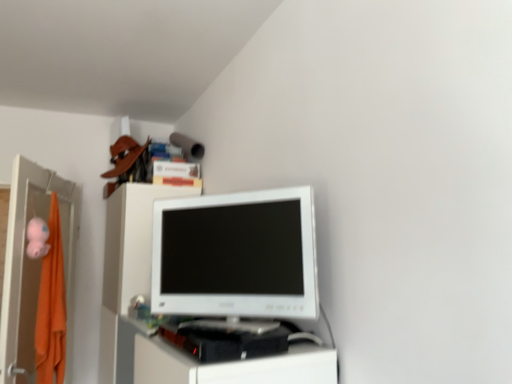
Question: Does white glossy computer monitor at center have a greater height compared to orange fabric file cabinet at left?

Choices:
 (A) no
 (B) yes

Answer: (A)

Question: Is orange fabric file cabinet at left at the back of white glossy computer monitor at center?

Choices:
 (A) no
 (B) yes

Answer: (A)

Question: Can we say white glossy computer monitor at center lies outside orange fabric file cabinet at left?

Choices:
 (A) yes
 (B) no

Answer: (A)

Question: Does white glossy computer monitor at center come behind orange fabric file cabinet at left?

Choices:
 (A) no
 (B) yes

Answer: (A)

Question: Is white glossy computer monitor at center to the right of orange fabric file cabinet at left from the viewer's perspective?

Choices:
 (A) yes
 (B) no

Answer: (A)

Question: Is white glossy computer monitor at center smaller than orange fabric file cabinet at left?

Choices:
 (A) no
 (B) yes

Answer: (B)

Question: From the image's perspective, is orange fabric file cabinet at left beneath white glossy computer monitor at center?

Choices:
 (A) yes
 (B) no

Answer: (A)

Question: Is orange fabric file cabinet at left taller than white glossy computer monitor at center?

Choices:
 (A) yes
 (B) no

Answer: (A)

Question: Would you say orange fabric file cabinet at left is a long distance from white glossy computer monitor at center?

Choices:
 (A) yes
 (B) no

Answer: (A)

Question: Is orange fabric file cabinet at left aimed at white glossy computer monitor at center?

Choices:
 (A) yes
 (B) no

Answer: (B)

Question: Would you say orange fabric file cabinet at left contains white glossy computer monitor at center?

Choices:
 (A) no
 (B) yes

Answer: (A)

Question: Does orange fabric file cabinet at left have a lesser height compared to white glossy computer monitor at center?

Choices:
 (A) no
 (B) yes

Answer: (A)

Question: From the image's perspective, is white glossy computer monitor at center above or below orange fabric file cabinet at left?

Choices:
 (A) below
 (B) above

Answer: (B)